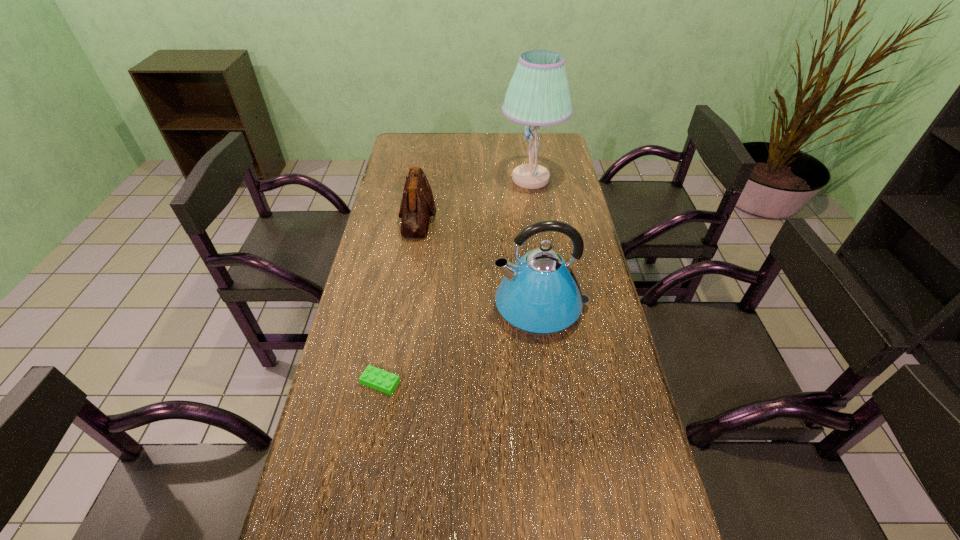
In order to click on free space located 0.400m on the back of the shoulder bag in this screenshot , I will do `click(430, 144)`.

The height and width of the screenshot is (540, 960). Identify the location of free space located 0.060m on the right of the shortest object. (424, 382).

What are the coordinates of `shoulder bag positioned at the left edge` in the screenshot? It's located at (417, 205).

Identify the location of Lego located in the left edge section of the desktop. This screenshot has width=960, height=540. (373, 377).

Where is `lamp that is at the right edge`? Image resolution: width=960 pixels, height=540 pixels. lamp that is at the right edge is located at coordinates (538, 94).

Find the location of a particular element. Image resolution: width=960 pixels, height=540 pixels. kettle located in the right edge section of the desktop is located at coordinates (539, 295).

Where is `vacant space at the far edge`? vacant space at the far edge is located at coordinates (478, 139).

Find the location of a particular element. The image size is (960, 540). blank area at the left edge is located at coordinates (386, 350).

The height and width of the screenshot is (540, 960). In the image, there is a desktop. In order to click on free space at the right edge in this screenshot , I will do coord(564,343).

I want to click on vacant space that's between the second shortest object and the second nearest object, so click(479, 262).